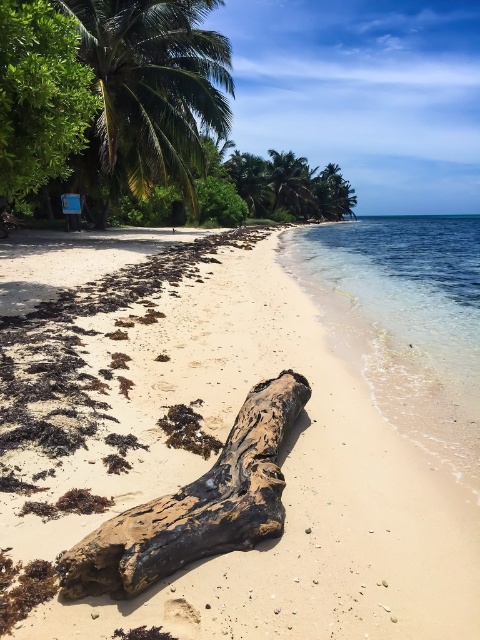
Looking at this image, can you confirm if brown weathered wood at center is positioned below green leafy palm tree at upper center?

Yes.

Between point (259, 508) and point (300, 156), which one is positioned behind?

The point (300, 156) is more distant.

Where is `brown weathered wood at center`? Image resolution: width=480 pixels, height=640 pixels. brown weathered wood at center is located at coordinates (196, 506).

Locate an element on the screen. brown weathered wood at center is located at coordinates (196, 506).

Which is below, green leafy palm tree at upper left or brown weathered wood at center?

brown weathered wood at center is lower down.

Does point (180, 100) come farther from viewer compared to point (164, 563)?

Yes, it is behind point (164, 563).

Who is more forward, [219,67] or [182,500]?

Point [182,500] is more forward.

Where is `green leafy palm tree at upper left`? Image resolution: width=480 pixels, height=640 pixels. green leafy palm tree at upper left is located at coordinates (153, 90).

This screenshot has height=640, width=480. Describe the element at coordinates (282, 468) in the screenshot. I see `brown sandy beach at center` at that location.

Who is positioned more to the left, brown sandy beach at center or green leafy palm tree at upper center?

From the viewer's perspective, brown sandy beach at center appears more on the left side.

Who is more distant from viewer, [186,328] or [304,166]?

Positioned behind is point [304,166].

Where is `brown sandy beach at center`? The width and height of the screenshot is (480, 640). brown sandy beach at center is located at coordinates (282, 468).